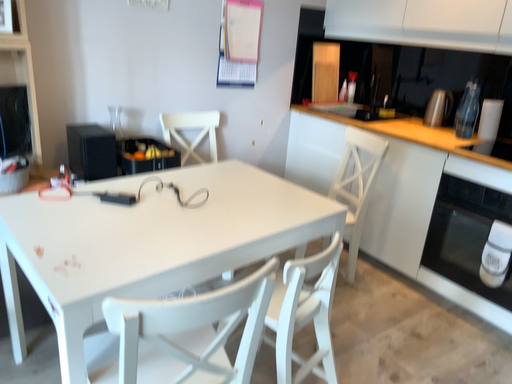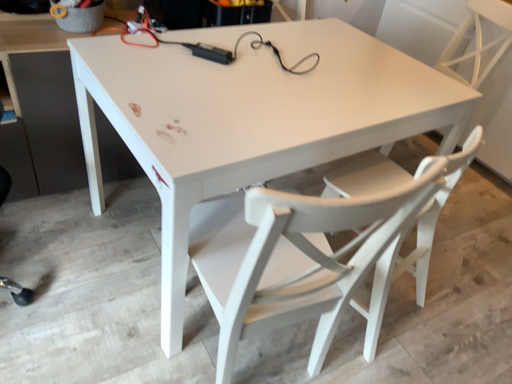
Question: How did the camera likely rotate when shooting the video?

Choices:
 (A) rotated downward
 (B) rotated upward

Answer: (A)